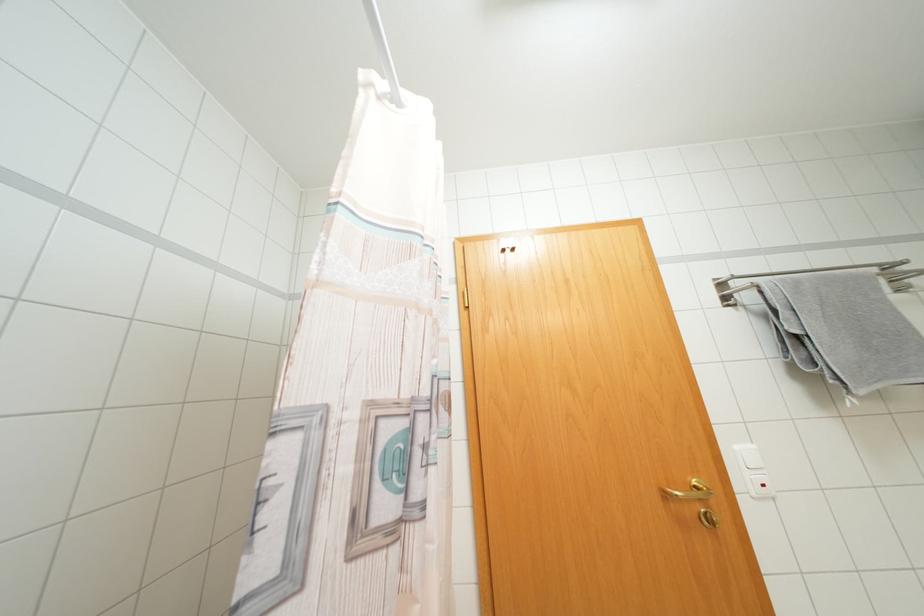
You are a GUI agent. You are given a task and a screenshot of the screen. Output one action in this format:
    pyautogui.click(x=<x>, y=<y>)
    Task: Click on the gold door handle
    
    Given the screenshot: What is the action you would take?
    pyautogui.click(x=688, y=492)